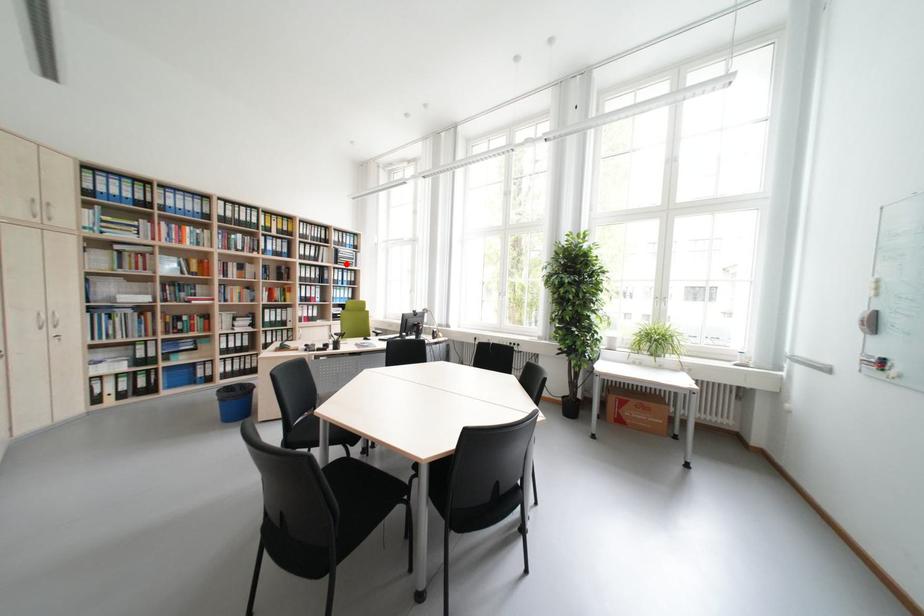
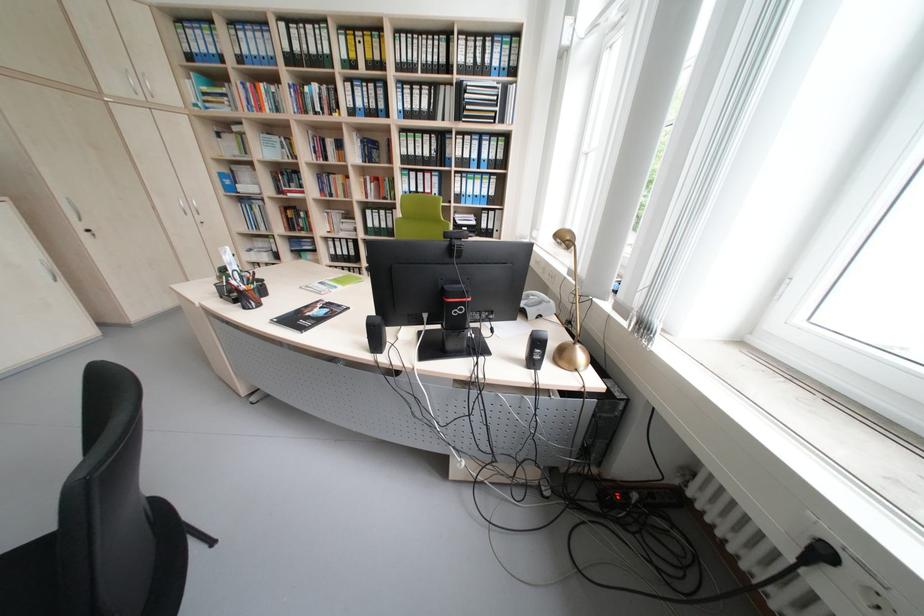
Question: I am providing you with two images of the same scene from different viewpoints. A red point is shown in image1. For the corresponding object point in image2, is it positioned nearer or farther from the camera?

Choices:
 (A) Nearer
 (B) Farther

Answer: (A)